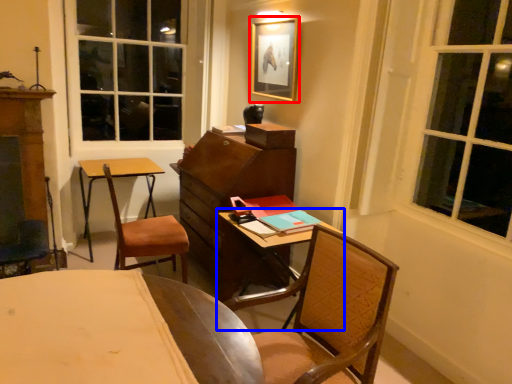
Question: Which of the following is the closest to the observer, picture frame (highlighted by a red box) or table (highlighted by a blue box)?

Choices:
 (A) picture frame
 (B) table

Answer: (B)